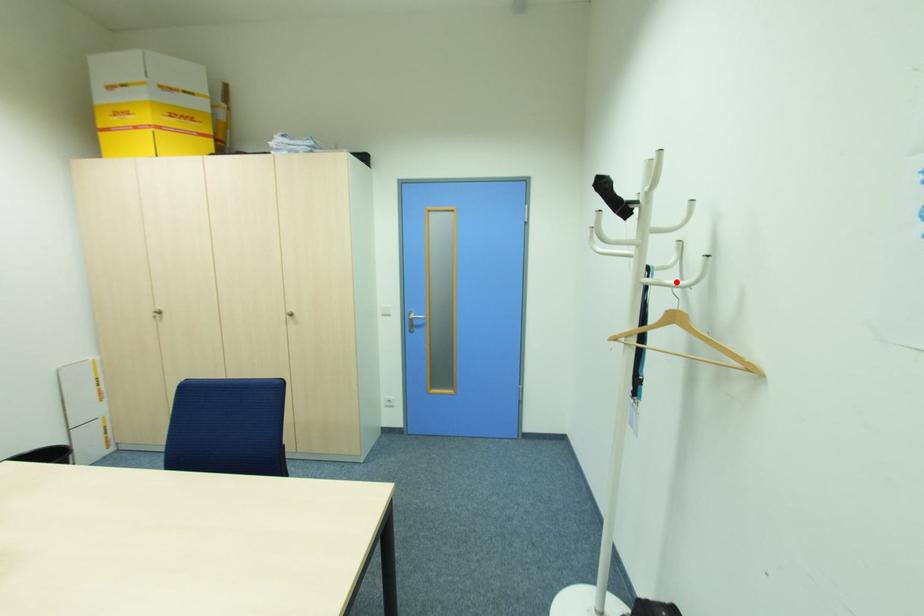
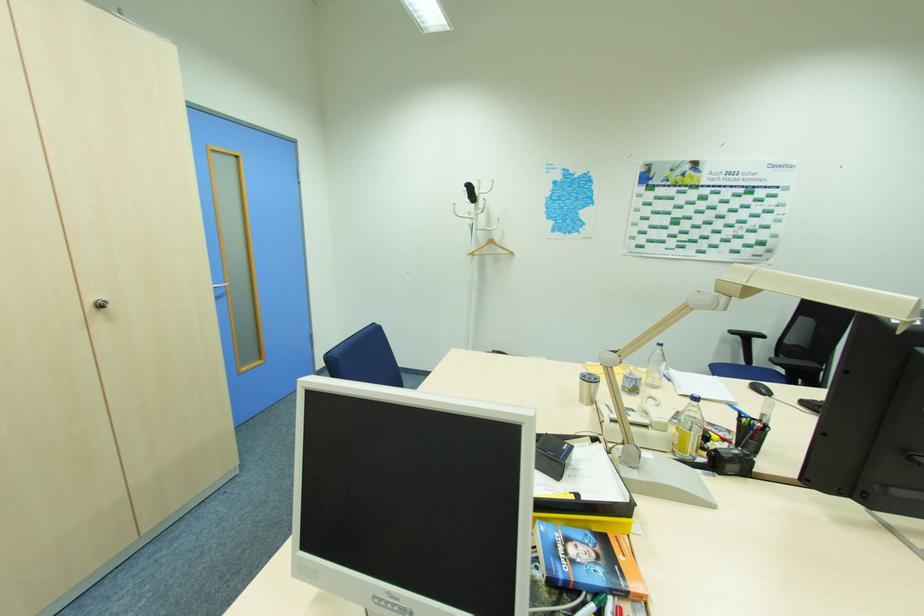
Where in the second image is the point corresponding to the highlighted location from the first image?

(492, 229)